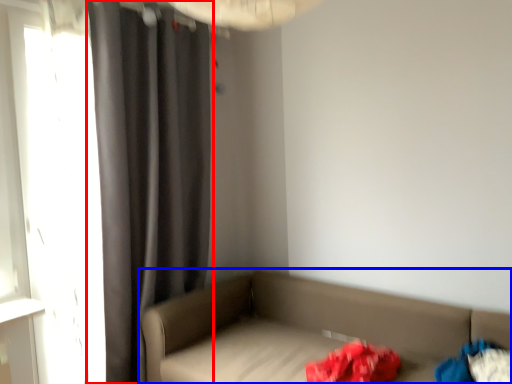
Question: Which point is closer to the camera, curtain (highlighted by a red box) or studio couch (highlighted by a blue box)?

Choices:
 (A) curtain
 (B) studio couch

Answer: (B)